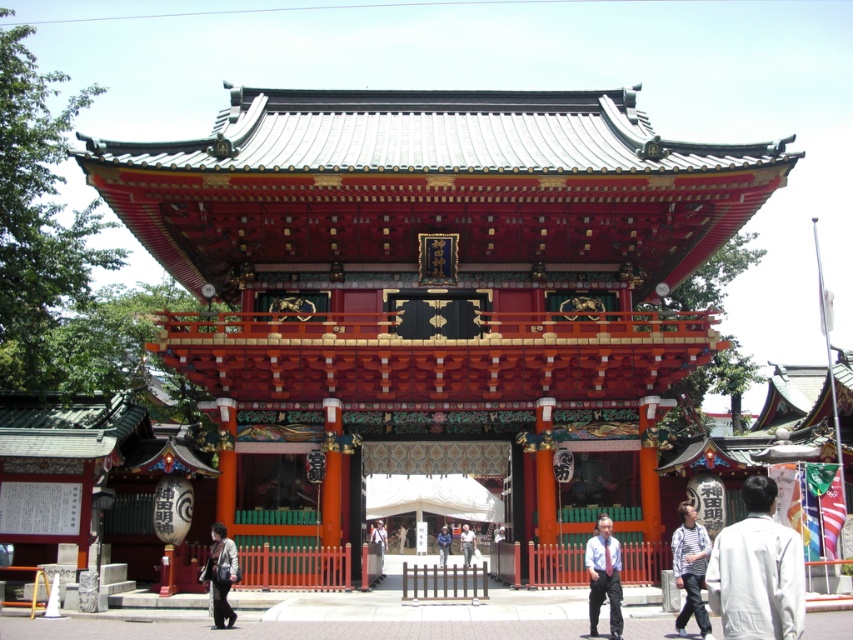
Does light gray fabric shirt at center come behind light blue denim jacket at center?

No, it is in front of light blue denim jacket at center.

Which is below, light gray fabric shirt at center or light blue denim jacket at center?

Positioned lower is light gray fabric shirt at center.

Locate an element on the screen. The height and width of the screenshot is (640, 853). light gray fabric shirt at center is located at coordinates (466, 544).

How distant is shiny lacquered shrine gate at center from light gray fabric shirt at center?

They are 96.42 feet apart.

Is point (422, 204) positioned after point (461, 528)?

No, it is not.

Locate an element on the screen. shiny lacquered shrine gate at center is located at coordinates (434, 288).

Which is behind, point (740, 541) or point (445, 557)?

The point (445, 557) is behind.

Can you confirm if white matte jacket at lower right is thinner than light blue denim jacket at center?

Yes, white matte jacket at lower right is thinner than light blue denim jacket at center.

I want to click on white matte jacket at lower right, so click(x=757, y=570).

Identify the location of white matte jacket at lower right. (757, 570).